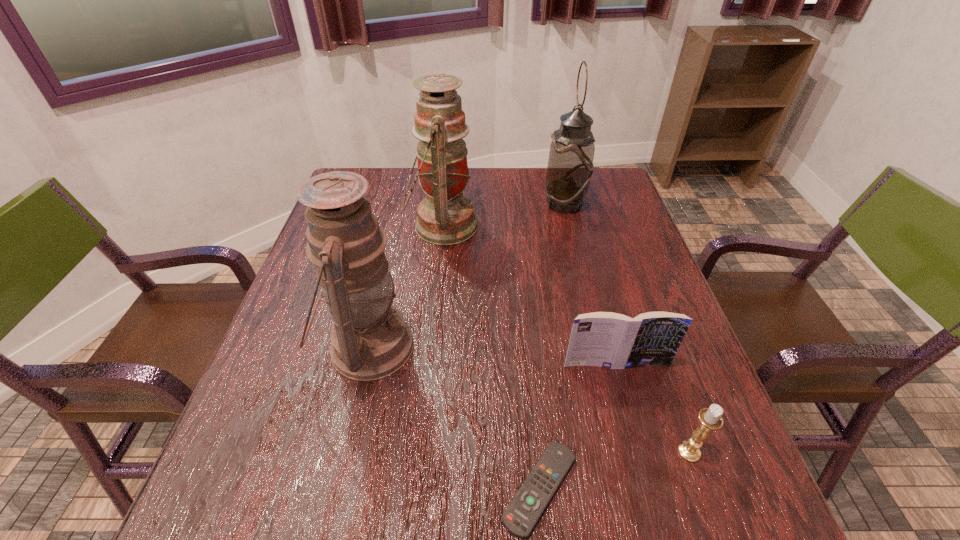
Where is `free space located 0.170m on the back of the third object from left to right`? This screenshot has width=960, height=540. free space located 0.170m on the back of the third object from left to right is located at coordinates pos(528,366).

Image resolution: width=960 pixels, height=540 pixels. I want to click on object at the near edge, so click(x=522, y=514).

This screenshot has width=960, height=540. Identify the location of object at the left edge. (370, 340).

Where is `oil lamp located in the right edge section of the desktop`? oil lamp located in the right edge section of the desktop is located at coordinates (570, 167).

The image size is (960, 540). Identify the location of book that is at the right edge. (606, 339).

This screenshot has height=540, width=960. Identify the location of candle holder located at the right edge. (710, 418).

The width and height of the screenshot is (960, 540). I want to click on object located in the far right corner section of the desktop, so click(570, 167).

In the image, there is a desktop. Identify the location of free space at the far edge. The width and height of the screenshot is (960, 540). (493, 203).

Identify the location of vacant point at the near edge. (661, 528).

In the image, there is a desktop. At what (x,y) coordinates should I click in order to perform the action: click on free space at the left edge. Please return your answer as a coordinate pair (x, y). This screenshot has height=540, width=960. Looking at the image, I should click on (282, 471).